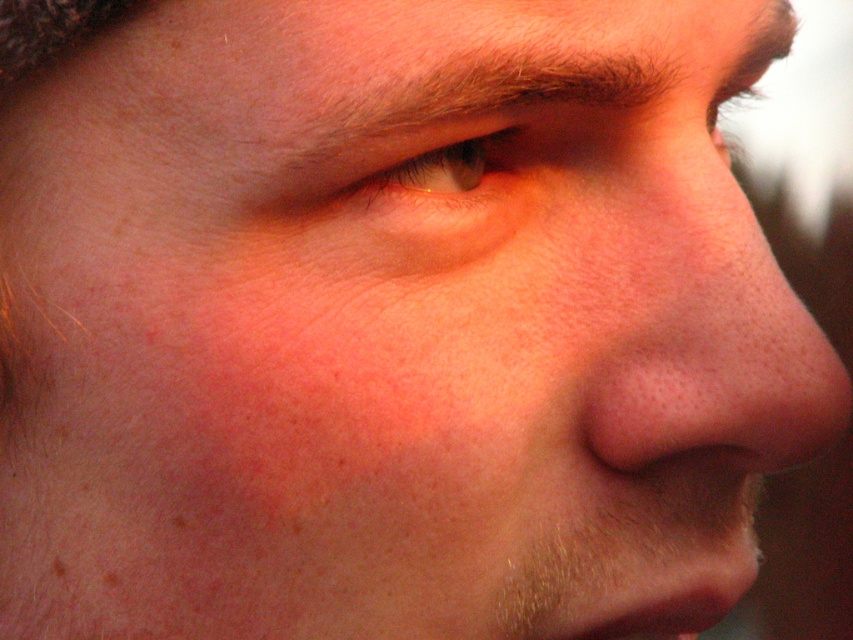
Is pink smooth skin at center further to the viewer compared to green matte eye at upper center?

Yes, pink smooth skin at center is further from the viewer.

Looking at this image, can you confirm if pink smooth skin at center is positioned to the right of green matte eye at upper center?

Correct, you'll find pink smooth skin at center to the right of green matte eye at upper center.

Is point (688, 353) positioned behind point (485, 141)?

No.

This screenshot has width=853, height=640. What are the coordinates of `pink smooth skin at center` in the screenshot? It's located at (723, 376).